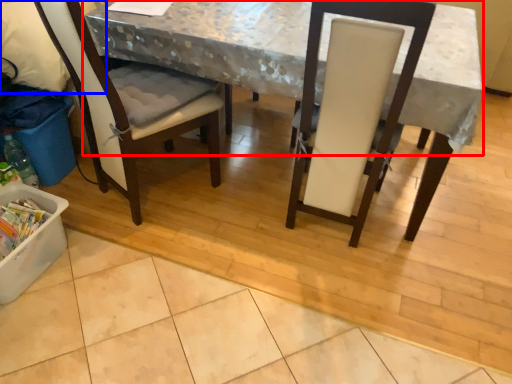
Question: Which of the following is the closest to the observer, table (highlighted by a red box) or leftover (highlighted by a blue box)?

Choices:
 (A) table
 (B) leftover

Answer: (A)